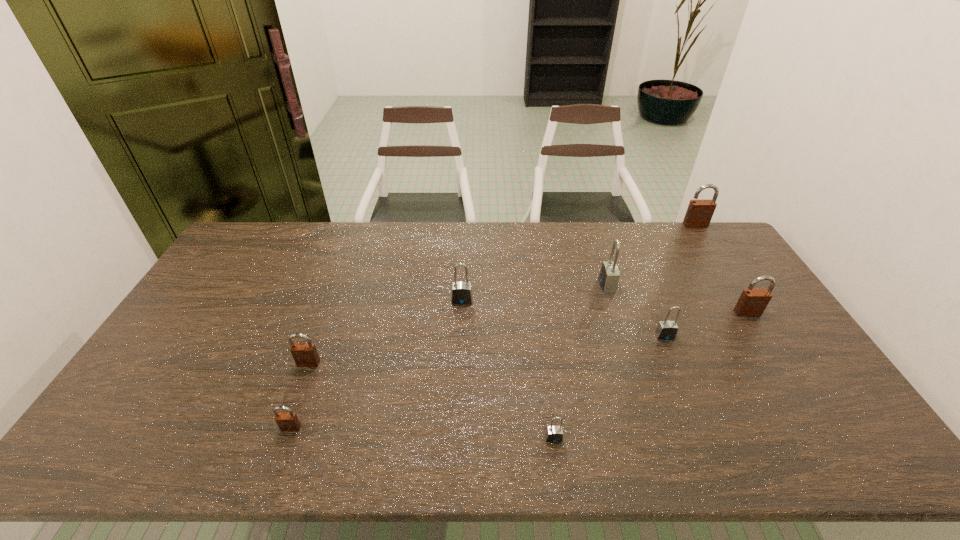
Select which object is the third closest to the biggest brown padlock. Please provide its 2D coordinates. Your answer should be formatted as a tuple, i.e. [(x, y)], where the tuple contains the x and y coordinates of a point satisfying the conditions above.

[(666, 330)]

Locate which object ranks in proximity to the second smallest brown padlock. Please provide its 2D coordinates. Your answer should be formatted as a tuple, i.e. [(x, y)], where the tuple contains the x and y coordinates of a point satisfying the conditions above.

[(288, 421)]

You are a GUI agent. You are given a task and a screenshot of the screen. Output one action in this format:
    pyautogui.click(x=<x>, y=<y>)
    Task: Click on the second closest padlock to the farthest padlock
    
    Given the screenshot: What is the action you would take?
    pyautogui.click(x=609, y=275)

Locate which padlock is the fourth closest to the third nearest brown padlock. Please provide its 2D coordinates. Your answer should be formatted as a tuple, i.e. [(x, y)], where the tuple contains the x and y coordinates of a point satisfying the conditions above.

[(554, 434)]

Identify which brown padlock is located as the second nearest to the farthest brown padlock. Please provide its 2D coordinates. Your answer should be formatted as a tuple, i.e. [(x, y)], where the tuple contains the x and y coordinates of a point satisfying the conditions above.

[(304, 354)]

Locate an element on the screen. brown padlock that can be found as the third closest to the farthest padlock is located at coordinates (288, 421).

The image size is (960, 540). Identify the location of gray padlock that can be found as the third closest to the third padlock from right to left. (461, 291).

Identify which gray padlock is located as the second nearest to the fifth padlock from right to left. Please provide its 2D coordinates. Your answer should be formatted as a tuple, i.e. [(x, y)], where the tuple contains the x and y coordinates of a point satisfying the conditions above.

[(461, 291)]

Locate an element on the screen. vacant space that satisfies the following two spatial constraints: 1. on the shackle of the farthest gray padlock; 2. on the shackle of the nearest object is located at coordinates (657, 438).